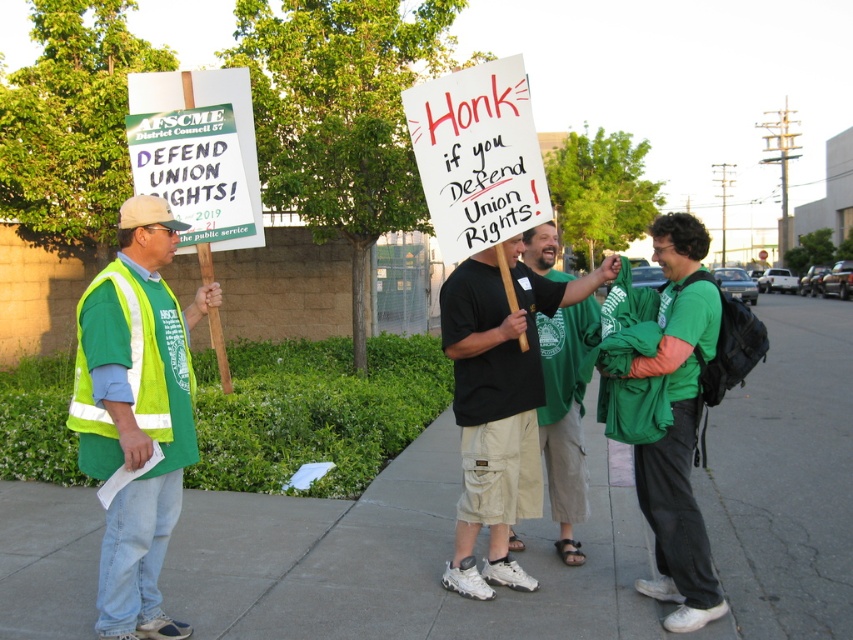
You are a journalist taking photos of the protest. You notice two signs in the crowd. The white paper sign at center and the green cardboard sign at left. Which one is bigger?

The white paper sign at center is larger than the green cardboard sign at left.

You are standing on the concrete sidewalk at center and want to hand a leaflet to the reflective yellow vest at left. Can you reach them without moving from your current position?

The concrete sidewalk at center is further to the viewer than reflective yellow vest at left, so you are closer to the reflective yellow vest at left and can reach them without moving.

You are a pedestrian walking past the demonstration. You notice the white paper sign at center and the green reflective safety vest at left. Which object is higher up in the image?

The white paper sign at center is positioned over the green reflective safety vest at left, meaning it is higher up in the image.